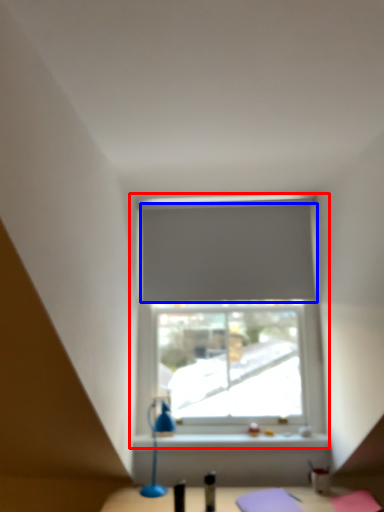
Question: Among these objects, which one is farthest to the camera, window (highlighted by a red box) or curtain (highlighted by a blue box)?

Choices:
 (A) window
 (B) curtain

Answer: (B)